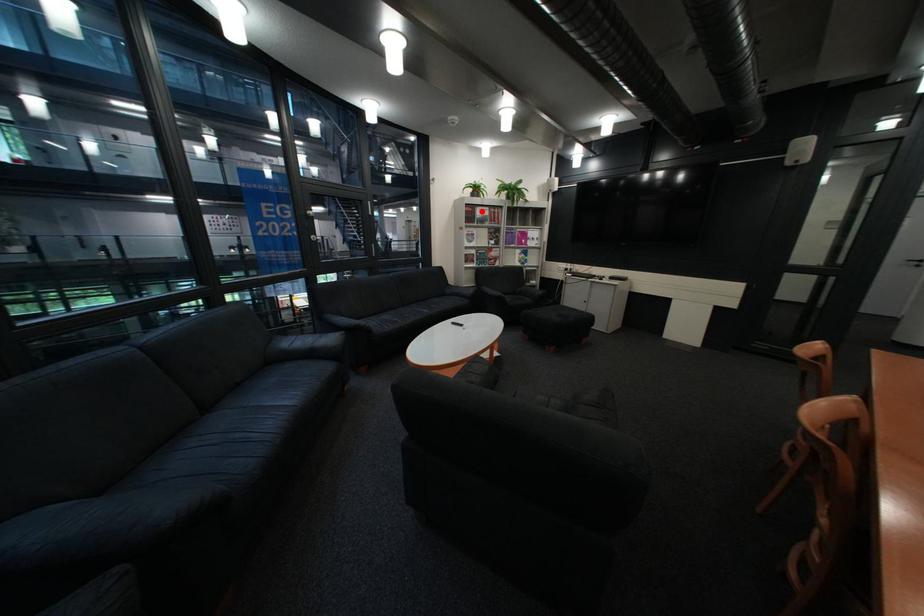
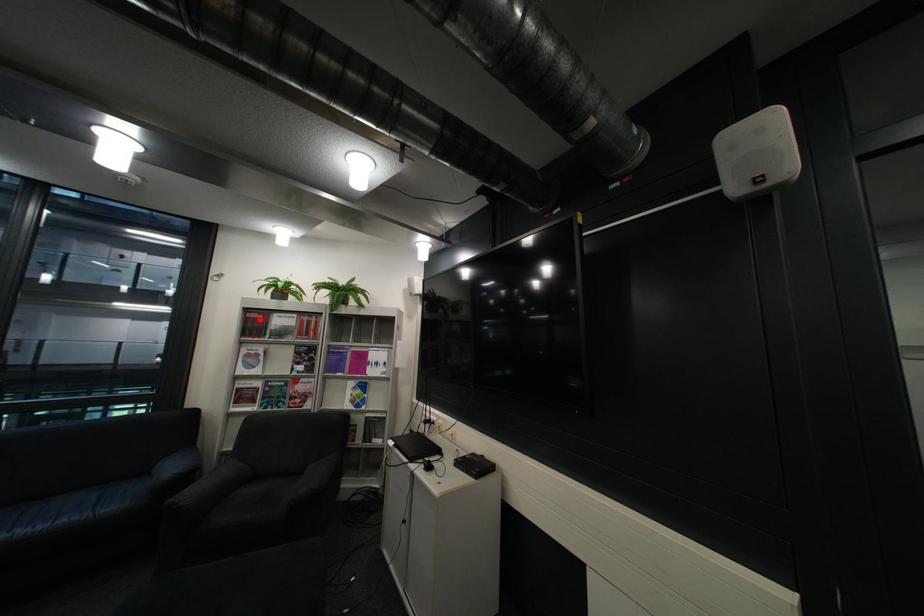
I am providing you with two images of the same scene from different viewpoints. A red point is marked on the first image and another point is marked on the second image. Does the point marked in image1 correspond to the same location as the one in image2?

Yes